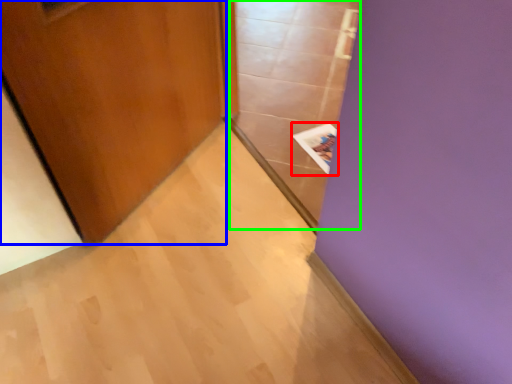
Question: Estimate the real-world distances between objects in this image. Which object is farther from magazine (highlighted by a red box), door (highlighted by a blue box) or glass door (highlighted by a green box)?

Choices:
 (A) door
 (B) glass door

Answer: (A)